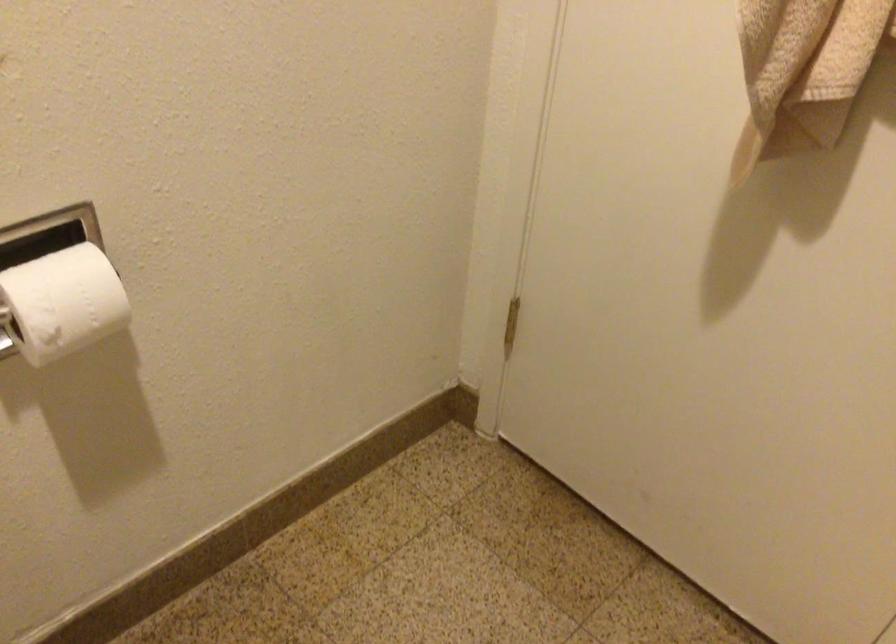
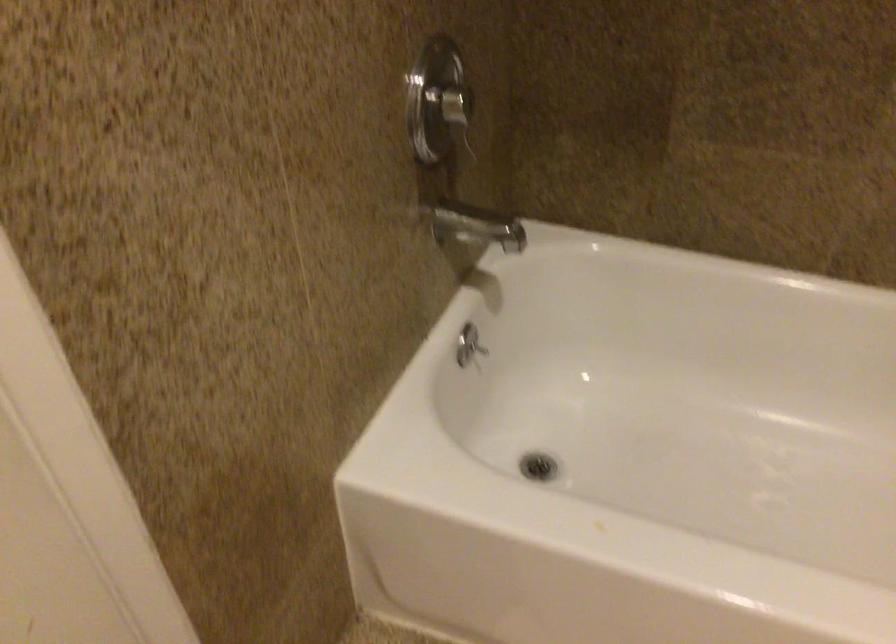
Based on the continuous images, in which direction is the camera rotating?

The camera's rotation is toward right-down.